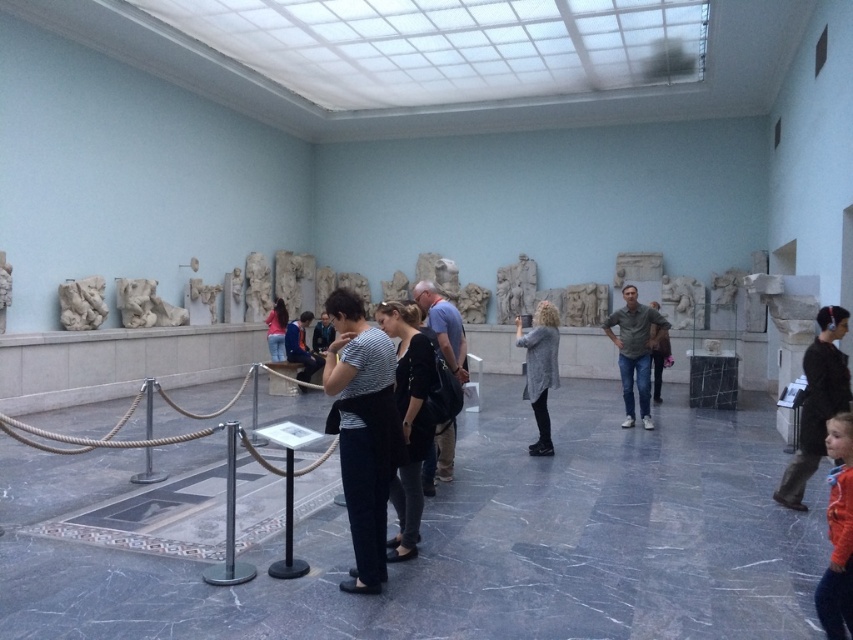
Question: Which object is the farthest from the black leather jacket at lower right?

Choices:
 (A) white marble relief at center
 (B) white marble sculpture at center
 (C) blue cotton shirt at center
 (D) gray cotton shirt at center

Answer: (B)

Question: Which of these objects is positioned farthest from the matte black dress at center?

Choices:
 (A) dark blue jeans at center
 (B) striped fabric shirt at center
 (C) gray wool sweater at center
 (D) black leather jacket at lower right

Answer: (D)

Question: Does matte black dress at center appear on the left side of dark gray sweater at center?

Choices:
 (A) no
 (B) yes

Answer: (B)

Question: Can you confirm if black leather jacket at lower right is positioned to the left of orange fleece jacket at lower right?

Choices:
 (A) no
 (B) yes

Answer: (A)

Question: Which point is closer to the camera?

Choices:
 (A) (286, 346)
 (B) (370, 449)

Answer: (B)

Question: Can you confirm if black fabric dress at center is positioned above dark blue jeans at center?

Choices:
 (A) no
 (B) yes

Answer: (A)